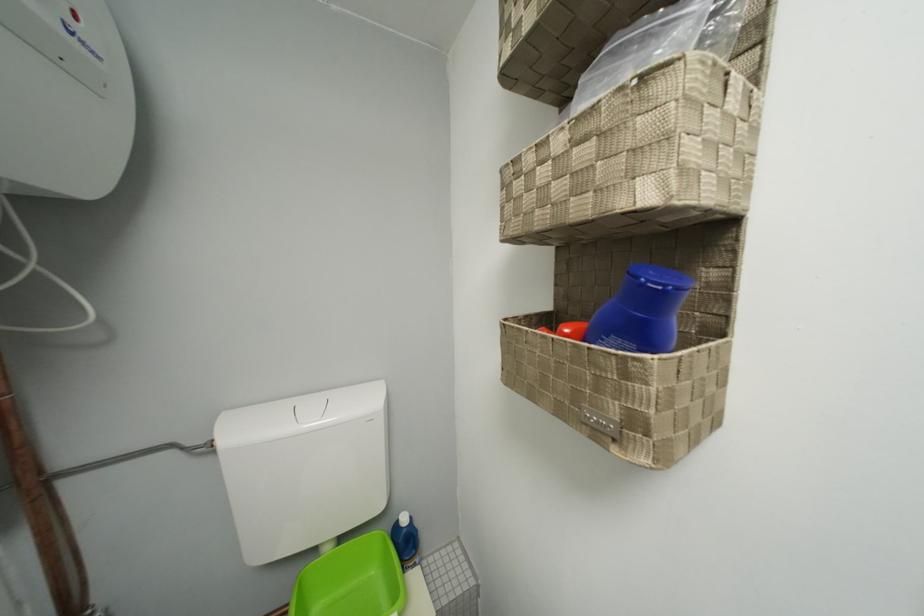
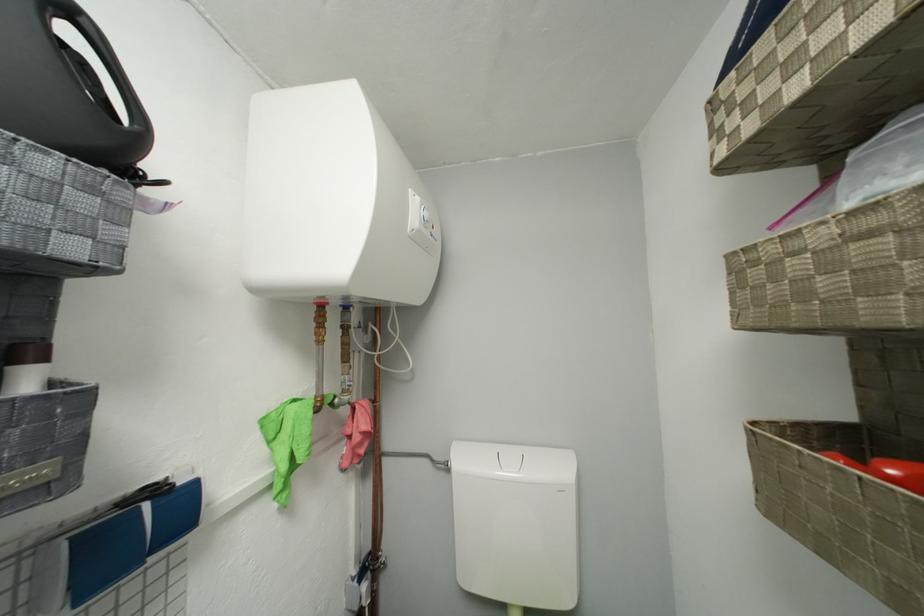
The point at (x=515, y=78) is marked in the first image. Where is the corresponding point in the second image?

(732, 171)